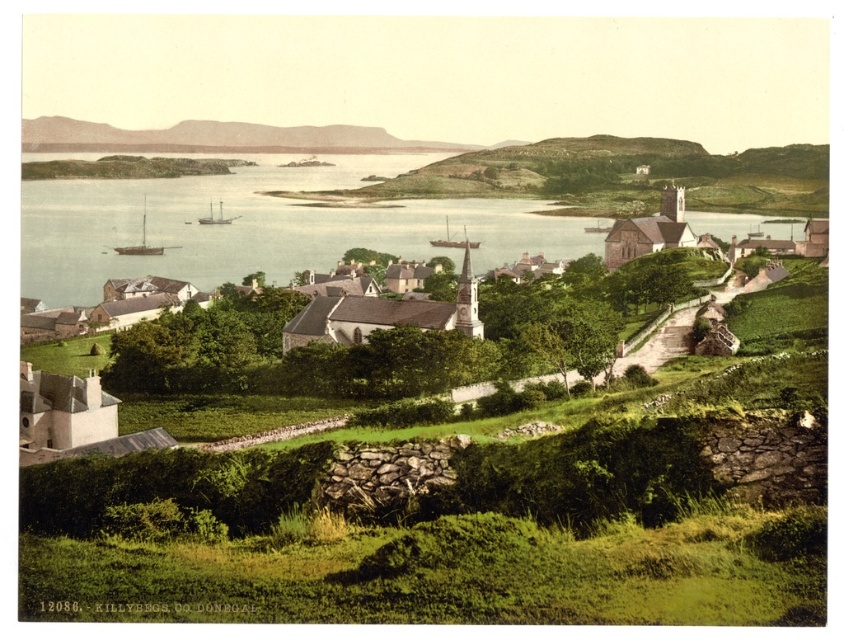
Can you confirm if wooden sailboat at left is shorter than white wooden ship at center-left?

No, wooden sailboat at left is not shorter than white wooden ship at center-left.

Where is `wooden sailboat at left`? The image size is (844, 640). wooden sailboat at left is located at coordinates (139, 241).

From the picture: Does blue water at center have a larger size compared to wooden sailboat at center?

Indeed, blue water at center has a larger size compared to wooden sailboat at center.

Is point (287, 205) positioned after point (442, 240)?

Yes, it is behind point (442, 240).

Identify the location of blue water at center. Image resolution: width=844 pixels, height=640 pixels. (264, 227).

Is point (331, 150) farther from camera compared to point (204, 218)?

Yes.

Between rustic stone wall at upper center and white wooden ship at center-left, which one appears on the left side from the viewer's perspective?

Positioned to the left is rustic stone wall at upper center.

Does point (199, 138) come in front of point (209, 221)?

No, (199, 138) is further to viewer.

Find the location of a particular element. The width and height of the screenshot is (844, 640). rustic stone wall at upper center is located at coordinates (218, 138).